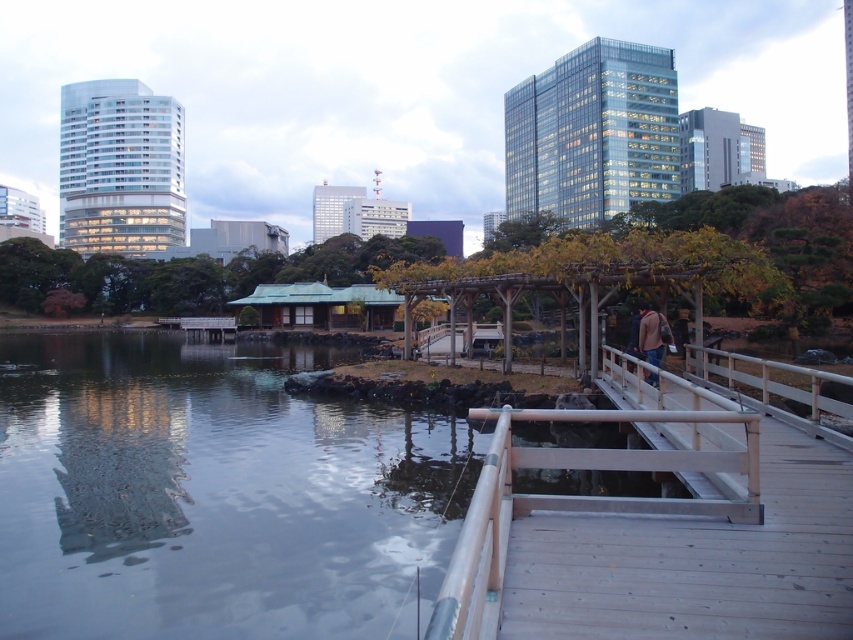
Question: Which object appears farthest from the camera in this image?

Choices:
 (A) brown leather jacket at center-right
 (B) light brown wooden dock at center

Answer: (A)

Question: Considering the relative positions of light brown wooden dock at center and brown leather jacket at center-right in the image provided, where is light brown wooden dock at center located with respect to brown leather jacket at center-right?

Choices:
 (A) left
 (B) right

Answer: (A)

Question: Is light brown wooden dock at center thinner than brown leather jacket at center-right?

Choices:
 (A) yes
 (B) no

Answer: (A)

Question: Is light brown wooden dock at center bigger than brown leather jacket at center-right?

Choices:
 (A) yes
 (B) no

Answer: (B)